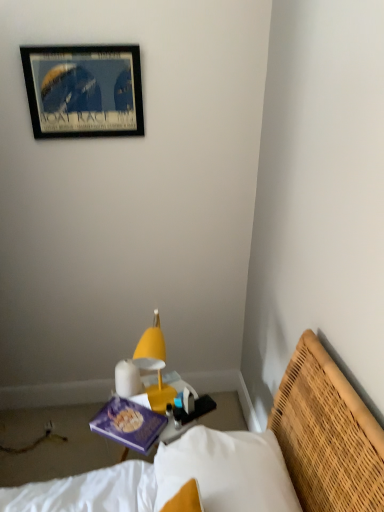
Measure the distance between point (128, 415) and camera.

Point (128, 415) and camera are 5.10 feet apart from each other.

Describe the element at coordinates (84, 90) in the screenshot. The width and height of the screenshot is (384, 512). I see `wooden framed poster at upper left` at that location.

You are a GUI agent. You are given a task and a screenshot of the screen. Output one action in this format:
    pyautogui.click(x=<x>, y=<y>)
    Task: Click on the purple matte book at center
    Image resolution: width=384 pixels, height=512 pixels.
    Given the screenshot: What is the action you would take?
    click(128, 424)

In terms of size, does yellow plastic lamp at center appear bigger or smaller than purple matte book at center?

Clearly, yellow plastic lamp at center is larger in size than purple matte book at center.

Is yellow plastic lamp at center in contact with purple matte book at center?

yellow plastic lamp at center is not next to purple matte book at center, and they're not touching.

Find the location of a particular element. This screenshot has width=384, height=512. book on the left of yellow plastic lamp at center is located at coordinates (128, 424).

From a real-world perspective, is yellow plastic lamp at center located beneath purple matte book at center?

Incorrect, from a real-world perspective, yellow plastic lamp at center is higher than purple matte book at center.

Considering the sizes of objects yellow woven bed at lower right and purple matte book at center in the image provided, who is taller, yellow woven bed at lower right or purple matte book at center?

Standing taller between the two is yellow woven bed at lower right.

Considering the sizes of objects yellow woven bed at lower right and purple matte book at center in the image provided, who is wider, yellow woven bed at lower right or purple matte book at center?

yellow woven bed at lower right.

From the image's perspective, is yellow woven bed at lower right located beneath purple matte book at center?

Yes.

Is yellow woven bed at lower right far from purple matte book at center?

Actually, yellow woven bed at lower right and purple matte book at center are a little close together.

Can you confirm if purple matte book at center is shorter than yellow plastic lamp at center?

Indeed, purple matte book at center has a lesser height compared to yellow plastic lamp at center.

Which object is closer to the camera, purple matte book at center or yellow plastic lamp at center?

yellow plastic lamp at center is more forward.

From the image's perspective, who appears lower, purple matte book at center or yellow plastic lamp at center?

purple matte book at center is shown below in the image.

At what (x,y) coordinates should I click in order to perform the action: click on book that is behind the yellow woven bed at lower right. Please return your answer as a coordinate pair (x, y). The width and height of the screenshot is (384, 512). Looking at the image, I should click on coord(128,424).

Could you tell me if purple matte book at center is facing yellow woven bed at lower right?

No, purple matte book at center is not aimed at yellow woven bed at lower right.

Can you tell me how much purple matte book at center and yellow woven bed at lower right differ in facing direction?

The angular difference between purple matte book at center and yellow woven bed at lower right is 60.8 degrees.

Which object is thinner, purple matte book at center or yellow woven bed at lower right?

purple matte book at center is thinner.

In the scene shown: Does wooden framed poster at upper left have a greater width compared to yellow plastic lamp at center?

Incorrect, the width of wooden framed poster at upper left does not surpass that of yellow plastic lamp at center.

From the image's perspective, is wooden framed poster at upper left above or below yellow plastic lamp at center?

wooden framed poster at upper left is situated higher than yellow plastic lamp at center in the image.

From the picture: Are wooden framed poster at upper left and yellow plastic lamp at center beside each other?

There is a gap between wooden framed poster at upper left and yellow plastic lamp at center.

Is wooden framed poster at upper left positioned far away from purple matte book at center?

Yes.

Considering the relative sizes of wooden framed poster at upper left and purple matte book at center in the image provided, is wooden framed poster at upper left taller than purple matte book at center?

Indeed, wooden framed poster at upper left has a greater height compared to purple matte book at center.

Can you tell me how much wooden framed poster at upper left and purple matte book at center differ in facing direction?

There is a 36.3-degree angle between the facing directions of wooden framed poster at upper left and purple matte book at center.

In the image, is wooden framed poster at upper left positioned in front of or behind purple matte book at center?

In the image, wooden framed poster at upper left appears behind purple matte book at center.

Is purple matte book at center located outside wooden framed poster at upper left?

Absolutely, purple matte book at center is external to wooden framed poster at upper left.

Is purple matte book at center at the right side of wooden framed poster at upper left?

Correct, you'll find purple matte book at center to the right of wooden framed poster at upper left.

Which object is closer to the camera, purple matte book at center or wooden framed poster at upper left?

purple matte book at center is in front.

You are a GUI agent. You are given a task and a screenshot of the screen. Output one action in this format:
    pyautogui.click(x=<x>, y=<y>)
    Task: Click on the book below the yellow plastic lamp at center (from the image's perspective)
    The image size is (384, 512).
    Given the screenshot: What is the action you would take?
    pyautogui.click(x=128, y=424)

Where is `bed lying in front of the purple matte book at center`? bed lying in front of the purple matte book at center is located at coordinates (287, 449).

Which object lies further to the anchor point yellow woven bed at lower right, wooden framed poster at upper left or purple matte book at center?

Among the two, wooden framed poster at upper left is located further to yellow woven bed at lower right.

Which object lies further to the anchor point yellow plastic lamp at center, purple matte book at center or yellow woven bed at lower right?

Among the two, yellow woven bed at lower right is located further to yellow plastic lamp at center.

In the scene shown: Which object lies nearer to the anchor point wooden framed poster at upper left, purple matte book at center or yellow plastic lamp at center?

Based on the image, yellow plastic lamp at center appears to be nearer to wooden framed poster at upper left.

Estimate the real-world distances between objects in this image. Which object is further from purple matte book at center, yellow plastic lamp at center or yellow woven bed at lower right?

The object further to purple matte book at center is yellow woven bed at lower right.

Looking at the image, which one is located closer to yellow plastic lamp at center, wooden framed poster at upper left or yellow woven bed at lower right?

Based on the image, yellow woven bed at lower right appears to be nearer to yellow plastic lamp at center.

Looking at the image, which one is located further to wooden framed poster at upper left, yellow woven bed at lower right or yellow plastic lamp at center?

yellow woven bed at lower right is positioned further to the anchor wooden framed poster at upper left.

When comparing their distances from yellow plastic lamp at center, does purple matte book at center or wooden framed poster at upper left seem closer?

purple matte book at center is positioned closer to the anchor yellow plastic lamp at center.

Which object lies nearer to the anchor point yellow plastic lamp at center, wooden framed poster at upper left or purple matte book at center?

purple matte book at center is closer to yellow plastic lamp at center.

Locate an element on the screen. This screenshot has width=384, height=512. lamp between wooden framed poster at upper left and purple matte book at center from top to bottom is located at coordinates (151, 342).

The width and height of the screenshot is (384, 512). I want to click on lamp between wooden framed poster at upper left and yellow woven bed at lower right in the up-down direction, so click(x=151, y=342).

Identify the location of lamp between yellow woven bed at lower right and purple matte book at center from front to back. This screenshot has width=384, height=512. pyautogui.click(x=151, y=342).

Where is `book between wooden framed poster at upper left and yellow woven bed at lower right from top to bottom`? book between wooden framed poster at upper left and yellow woven bed at lower right from top to bottom is located at coordinates (128, 424).